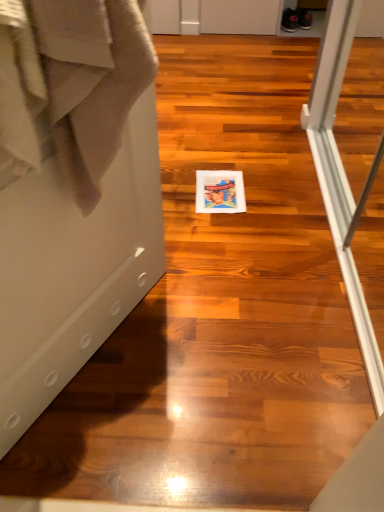
I want to click on vacant space underneath white glossy screen door at center (from a real-world perspective), so click(x=96, y=365).